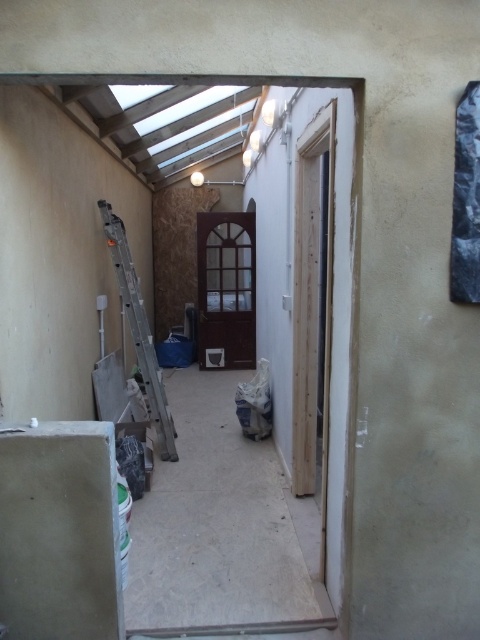
Which of these two, brown wooden door at center or silver metallic ladder at left, stands shorter?

silver metallic ladder at left is shorter.

Can you confirm if brown wooden door at center is thinner than silver metallic ladder at left?

No.

This screenshot has height=640, width=480. Identify the location of brown wooden door at center. [226, 289].

You are a GUI agent. You are given a task and a screenshot of the screen. Output one action in this format:
    pyautogui.click(x=<x>, y=<y>)
    Task: Click on the brown wooden door at center
    Image resolution: width=480 pixels, height=640 pixels.
    Given the screenshot: What is the action you would take?
    pyautogui.click(x=226, y=289)